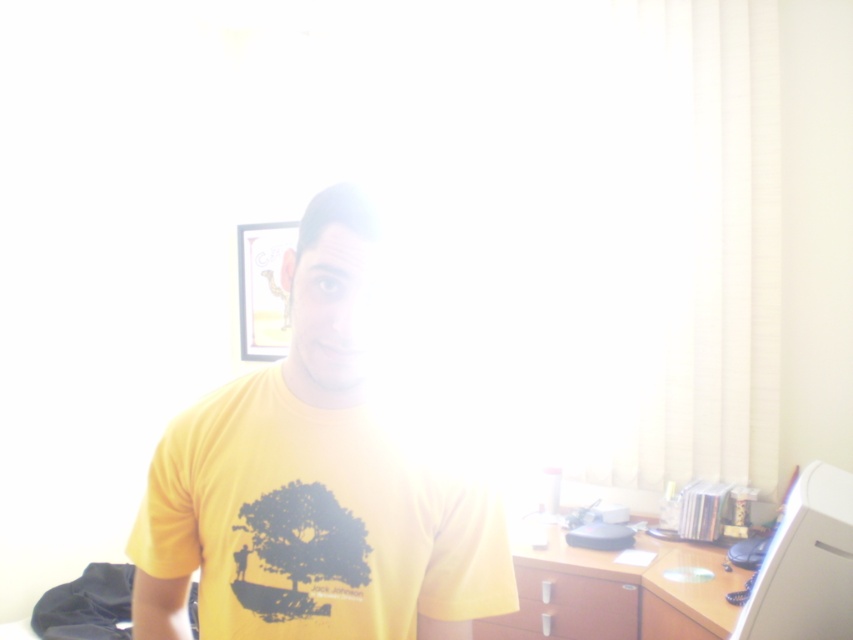
Between yellow matte t-shirt at center and brown wood dresser at lower right, which one has more height?

yellow matte t-shirt at center

You are a GUI agent. You are given a task and a screenshot of the screen. Output one action in this format:
    pyautogui.click(x=<x>, y=<y>)
    Task: Click on the yellow matte t-shirt at center
    
    Given the screenshot: What is the action you would take?
    pyautogui.click(x=315, y=481)

Does yellow matte t-shirt at center have a lesser height compared to matte brown drawer at lower center?

No, yellow matte t-shirt at center is not shorter than matte brown drawer at lower center.

Is yellow matte t-shirt at center above matte brown drawer at lower center?

Yes, yellow matte t-shirt at center is above matte brown drawer at lower center.

Describe the element at coordinates (315, 481) in the screenshot. I see `yellow matte t-shirt at center` at that location.

Find the location of a particular element. This screenshot has width=853, height=640. yellow matte t-shirt at center is located at coordinates (315, 481).

Where is `brown wood dresser at lower right`? This screenshot has height=640, width=853. brown wood dresser at lower right is located at coordinates (613, 593).

Is brown wood dresser at lower right to the left of white plastic computer at right from the viewer's perspective?

Indeed, brown wood dresser at lower right is positioned on the left side of white plastic computer at right.

Is point (527, 531) farther from viewer compared to point (792, 508)?

Yes, point (527, 531) is farther from viewer.

The image size is (853, 640). I want to click on brown wood dresser at lower right, so click(x=613, y=593).